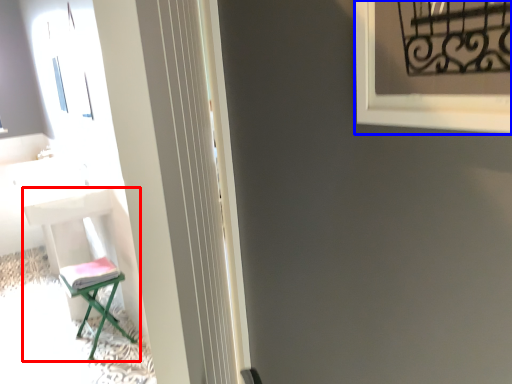
Question: Among these objects, which one is farthest to the camera, furniture (highlighted by a red box) or window frame (highlighted by a blue box)?

Choices:
 (A) furniture
 (B) window frame

Answer: (A)